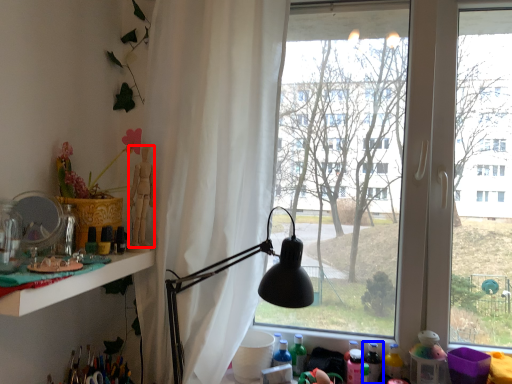
Question: Which point is further to the camera, person (highlighted by a red box) or bottle (highlighted by a blue box)?

Choices:
 (A) person
 (B) bottle

Answer: (B)